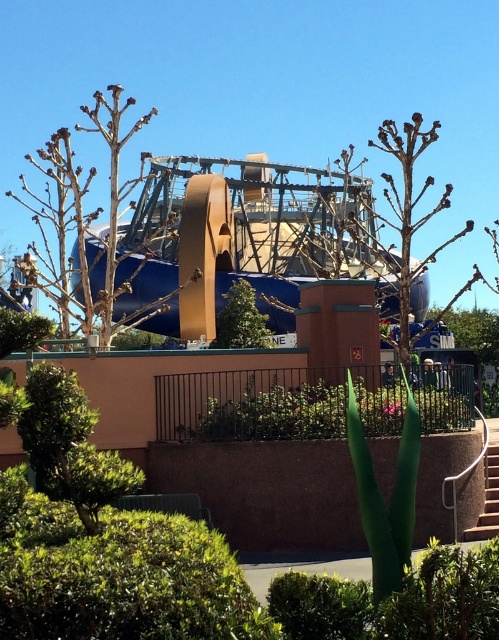
From the picture: You are a maintenance worker needing to move a heavy equipment cart from the lower right to the center of the image. Which path would allow you to move the cart without obstruction, the green leafy hedge at center or the white concrete stairs at lower right?

The white concrete stairs at lower right occupies more space than the green leafy hedge at center, so moving the cart through the white concrete stairs at lower right would provide a wider path and less obstruction.

You are a maintenance worker needing to reach the white concrete stairs at lower right from the green leafy hedge at center. Can you walk directly to the stairs without going around?

The green leafy hedge at center is 6.94 meters away from the white concrete stairs at lower right. Since the distance is clear, you can walk directly to the stairs without needing to go around.

You are a landscape architect designing a garden path that needs to accommodate both a wheelchair and a stroller. The path must pass between the green leafy hedge at center and the green leafy tree at center. According to the scene description, which object should be placed closer to the path to ensure sufficient clearance?

The green leafy hedge at center is shorter than the green leafy tree at center. To ensure sufficient clearance for the wheelchair and stroller, the path should be closer to the shorter hedge to avoid obstruction from the taller tree.